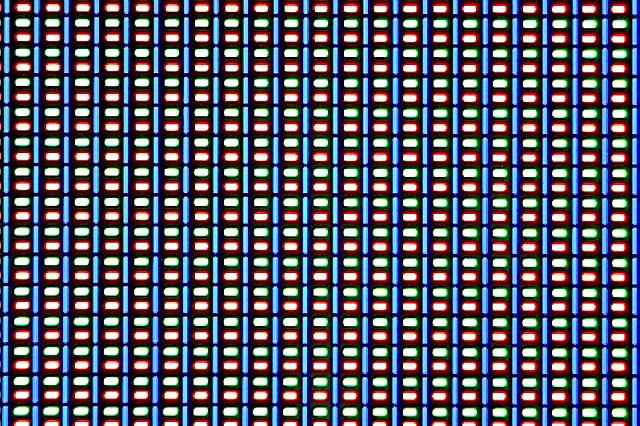
This screenshot has height=426, width=640. In order to click on green light in this screenshot , I will do `click(285, 140)`.